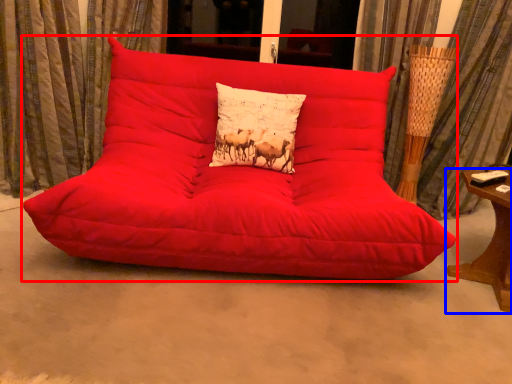
Question: Which object appears farthest to the camera in this image, studio couch (highlighted by a red box) or table (highlighted by a blue box)?

Choices:
 (A) studio couch
 (B) table

Answer: (B)